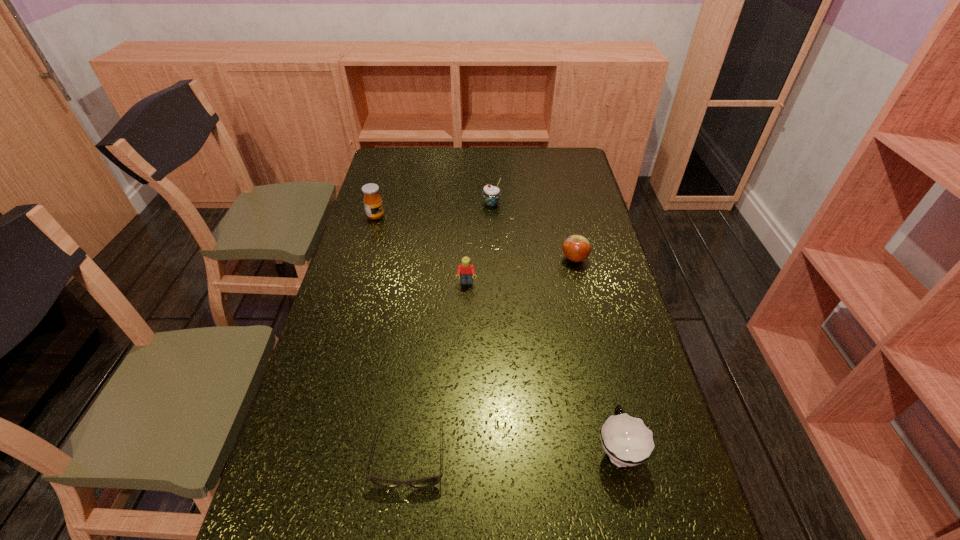
Where is `unoccupied area between the third farthest object and the cup`? unoccupied area between the third farthest object and the cup is located at coordinates (596, 354).

Where is `free space between the leftmost object and the fourth farthest object`? This screenshot has width=960, height=540. free space between the leftmost object and the fourth farthest object is located at coordinates (421, 249).

Find the location of `object that is the closest to the shortest object`. object that is the closest to the shortest object is located at coordinates (627, 441).

Image resolution: width=960 pixels, height=540 pixels. I want to click on the closest object to the honey, so click(491, 194).

Locate an element on the screen. vacant space that satisfies the following two spatial constraints: 1. on the front-facing side of the fourth nearest object; 2. on the left side of the fifth nearest object is located at coordinates (364, 259).

Where is `free space that satisfies the following two spatial constraints: 1. on the side of the fourth nearest object with the handle; 2. on the right side of the cup`? The image size is (960, 540). free space that satisfies the following two spatial constraints: 1. on the side of the fourth nearest object with the handle; 2. on the right side of the cup is located at coordinates (574, 259).

I want to click on vacant space that satisfies the following two spatial constraints: 1. on the front-facing side of the apple; 2. on the right side of the honey, so 364,259.

The width and height of the screenshot is (960, 540). What are the coordinates of `vacant region that satisfies the following two spatial constraints: 1. on the front-facing side of the second farthest object; 2. on the side of the cup with the handle` in the screenshot? It's located at (309, 449).